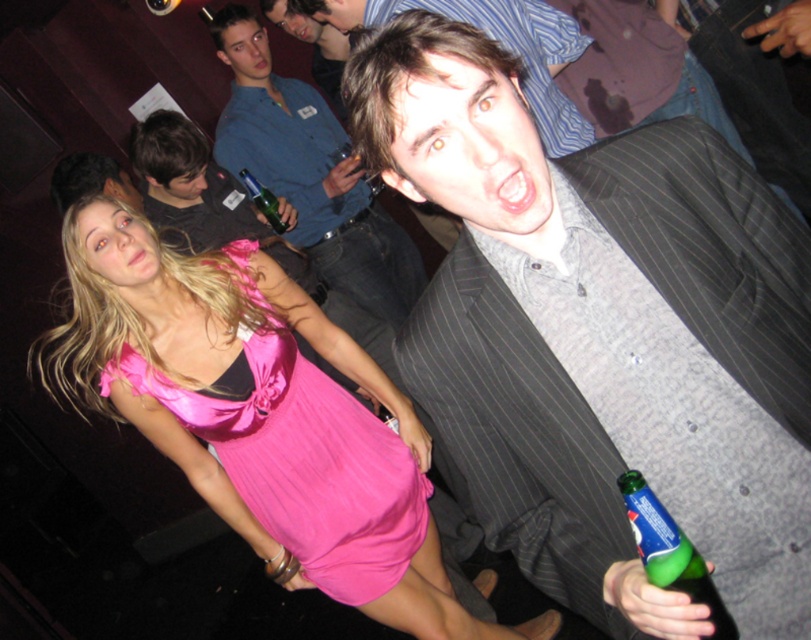
You are a photographer at the event and need to position two guests for a photo. The guests are wearing the gray pinstripe suit at upper right and the matte black suit at upper right. If you want to ensure both suits are fully visible in the frame, which guest should stand closer to the camera?

The gray pinstripe suit at upper right might be wider than the matte black suit at upper right, so the guest in the gray pinstripe suit at upper right should stand closer to the camera to ensure their entire suit fits within the frame.

Based on the scene description, where is the gray pinstripe suit at center located in the image?

The gray pinstripe suit at center is located at point (x=601, y=333) in the image.